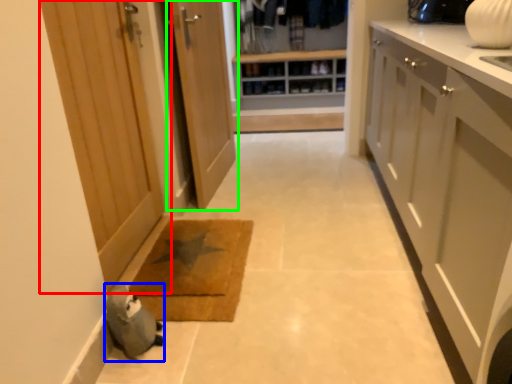
Question: Which is nearer to the door (highlighted by a red box)? animal (highlighted by a blue box) or door (highlighted by a green box).

Choices:
 (A) animal
 (B) door

Answer: (B)